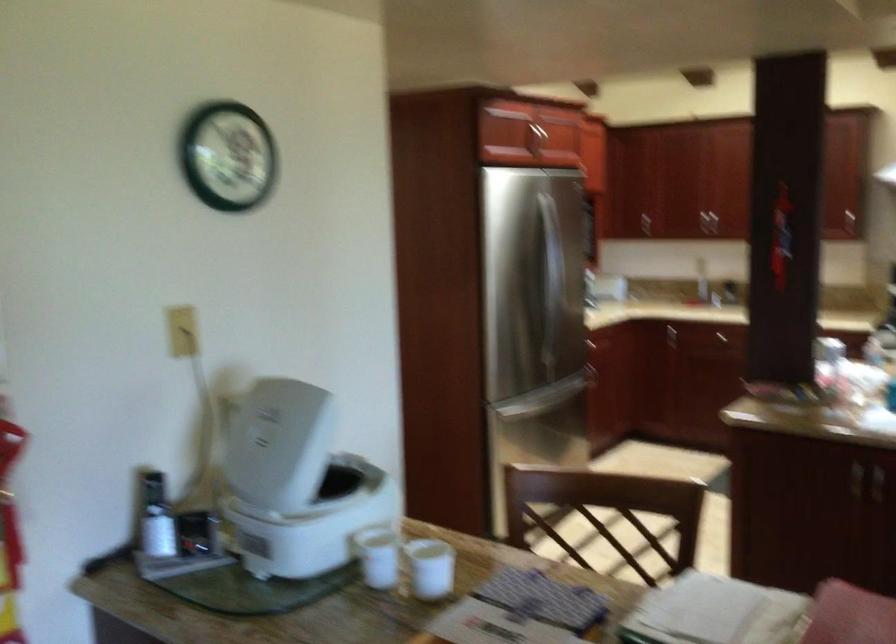
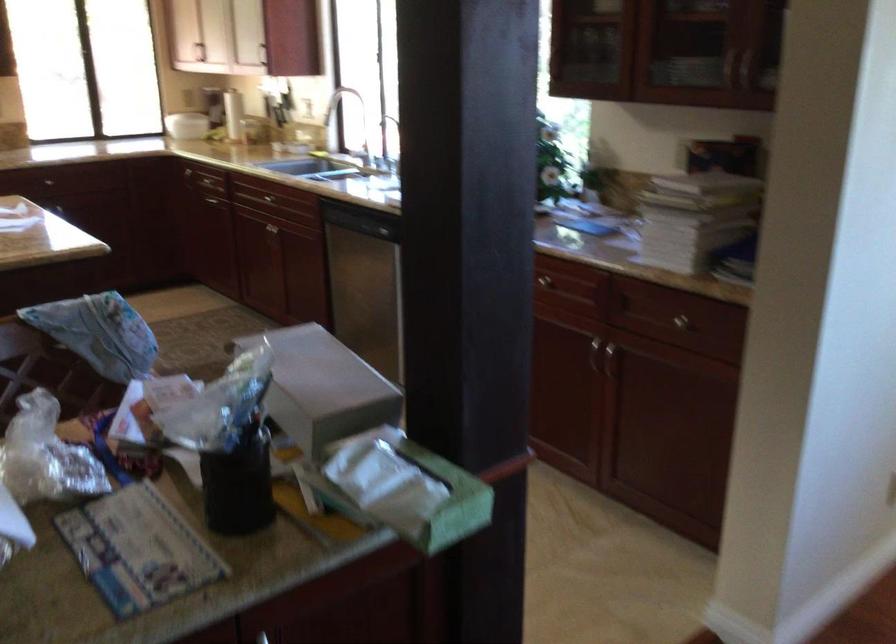
Question: The camera is either moving clockwise (left) or counter-clockwise (right) around the object. The first image is from the beginning of the video and the second image is from the end. Is the camera moving left or right when shooting the video?

Choices:
 (A) Left
 (B) Right

Answer: (A)